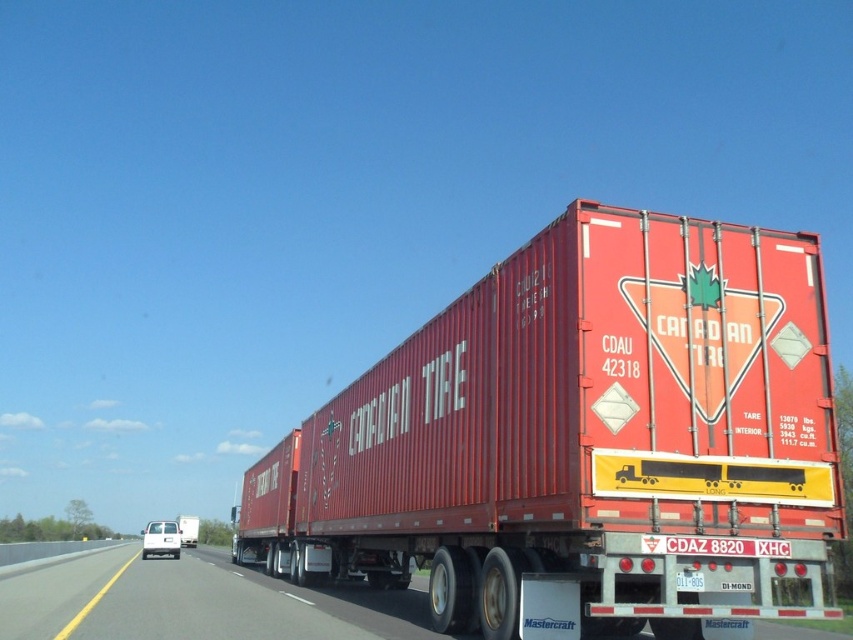
Does metallic red trailer truck at center lie in front of metallic silver truck at center?

That is True.

Between metallic red trailer truck at center and metallic silver truck at center, which one has less height?

metallic red trailer truck at center is shorter.

The image size is (853, 640). I want to click on metallic red trailer truck at center, so click(582, 436).

Does metallic red trailer truck at center appear under matte red trailer at center?

No, metallic red trailer truck at center is not below matte red trailer at center.

Between metallic red trailer truck at center and matte red trailer at center, which one has more height?

matte red trailer at center

The width and height of the screenshot is (853, 640). I want to click on metallic red trailer truck at center, so (x=582, y=436).

Who is more distant from viewer, (136, 570) or (195, 536)?

Positioned behind is point (195, 536).

What do you see at coordinates (193, 602) in the screenshot? This screenshot has width=853, height=640. I see `metallic silver truck at center` at bounding box center [193, 602].

Identify the location of metallic silver truck at center. This screenshot has height=640, width=853. (193, 602).